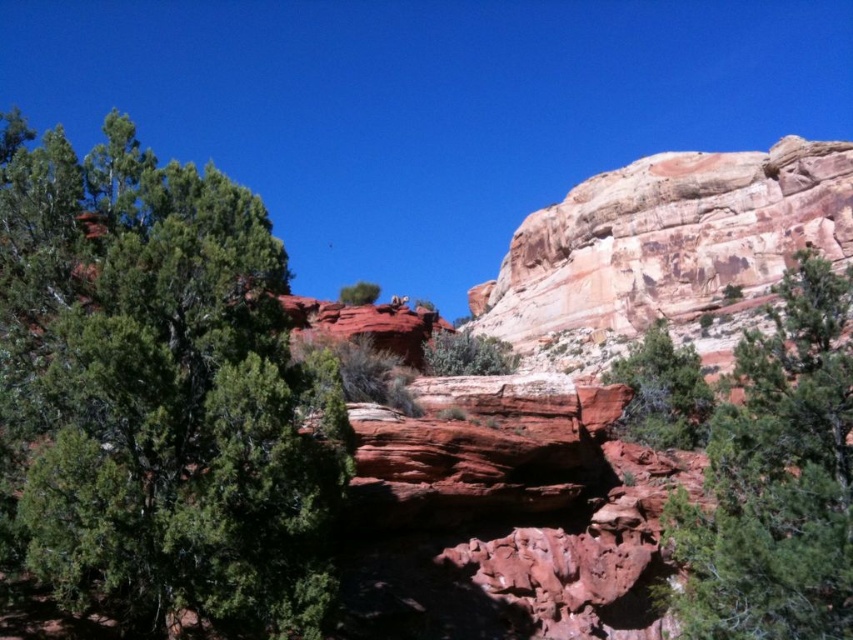
Question: Can you confirm if green leafy tree at upper left is positioned to the left of green textured tree at center?

Choices:
 (A) yes
 (B) no

Answer: (A)

Question: Considering the relative positions of green matte tree at center and green matte tree at upper center in the image provided, where is green matte tree at center located with respect to green matte tree at upper center?

Choices:
 (A) below
 (B) above

Answer: (A)

Question: Which object is farther from the camera taking this photo?

Choices:
 (A) rustic sandstone cliff at upper right
 (B) green matte tree at center
 (C) green leafy tree at upper left

Answer: (A)

Question: Which object is farther from the camera taking this photo?

Choices:
 (A) rustic sandstone cliff at upper right
 (B) green leafy shrub at center
 (C) green matte tree at upper center

Answer: (A)

Question: Which point is farther to the camera?

Choices:
 (A) (341, 298)
 (B) (654, 401)
 (C) (843, 417)
 (D) (38, 433)

Answer: (B)

Question: Does green leafy tree at upper left have a greater width compared to green textured tree at center?

Choices:
 (A) no
 (B) yes

Answer: (A)